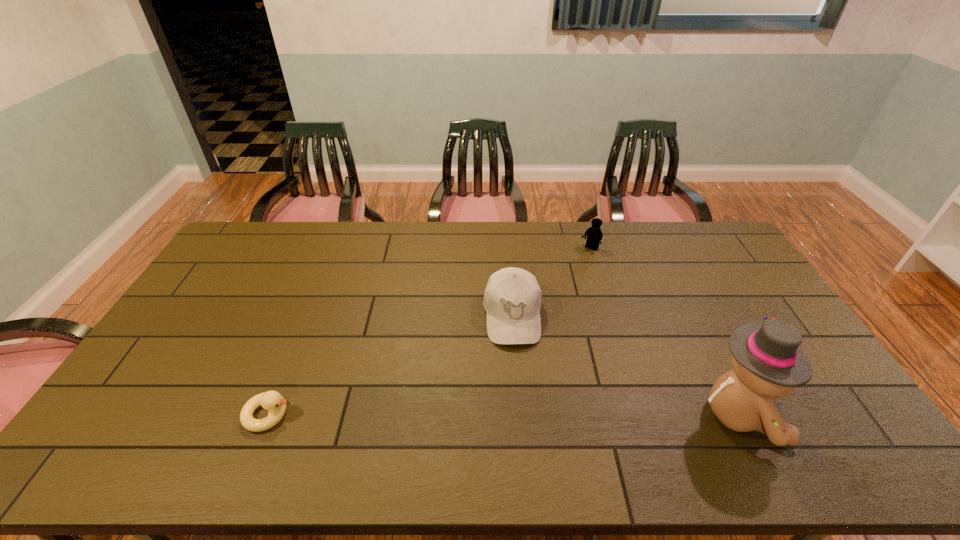
Identify the location of duckling. Image resolution: width=960 pixels, height=540 pixels. (272, 401).

You are a GUI agent. You are given a task and a screenshot of the screen. Output one action in this format:
    pyautogui.click(x=<x>, y=<y>)
    Task: Click on the leftmost object
    
    Given the screenshot: What is the action you would take?
    pyautogui.click(x=272, y=401)

At what (x,y) coordinates should I click in order to perform the action: click on the tallest object. Please return your answer as a coordinate pair (x, y). This screenshot has width=960, height=540. Looking at the image, I should click on (768, 362).

Where is `the rightmost object`? The height and width of the screenshot is (540, 960). the rightmost object is located at coordinates (768, 362).

This screenshot has width=960, height=540. I want to click on the second farthest object, so click(x=512, y=299).

This screenshot has width=960, height=540. I want to click on the third object from right to left, so click(x=512, y=299).

At what (x,y) coordinates should I click in order to perform the action: click on Lego. Please return your answer as a coordinate pair (x, y). Looking at the image, I should click on (594, 234).

I want to click on the farthest object, so click(594, 234).

Locate an element on the screen. This screenshot has height=540, width=960. vacant position located 0.080m at the beak of the duckling is located at coordinates (324, 415).

Image resolution: width=960 pixels, height=540 pixels. What are the coordinates of `free space located on the front-facing side of the tallest object` in the screenshot? It's located at (851, 415).